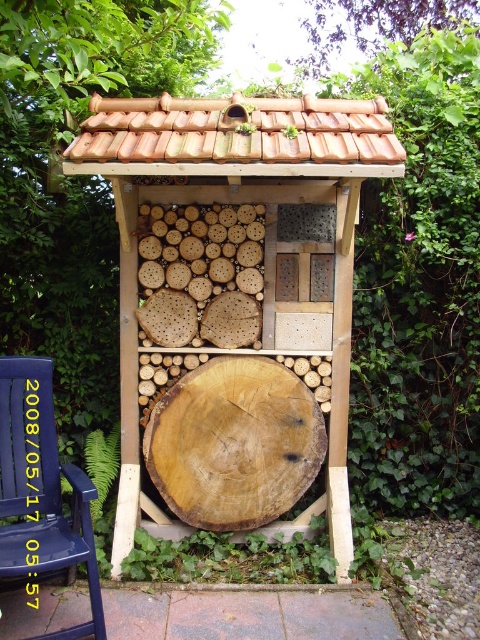
Question: Which of the following is the closest to the observer?

Choices:
 (A) [14, 492]
 (B) [194, 390]

Answer: (A)

Question: Does wooden insect hotel at center have a larger size compared to blue wood chair at lower left?

Choices:
 (A) yes
 (B) no

Answer: (A)

Question: Which point is farther from the camera taking this photo?

Choices:
 (A) (285, 156)
 (B) (31, 444)

Answer: (B)

Question: Can you confirm if wooden insect hotel at center is smaller than blue wood chair at lower left?

Choices:
 (A) yes
 (B) no

Answer: (B)

Question: Does wooden insect hotel at center appear on the left side of blue wood chair at lower left?

Choices:
 (A) yes
 (B) no

Answer: (B)

Question: Which point is farther to the camera?

Choices:
 (A) (288, 406)
 (B) (51, 637)

Answer: (A)